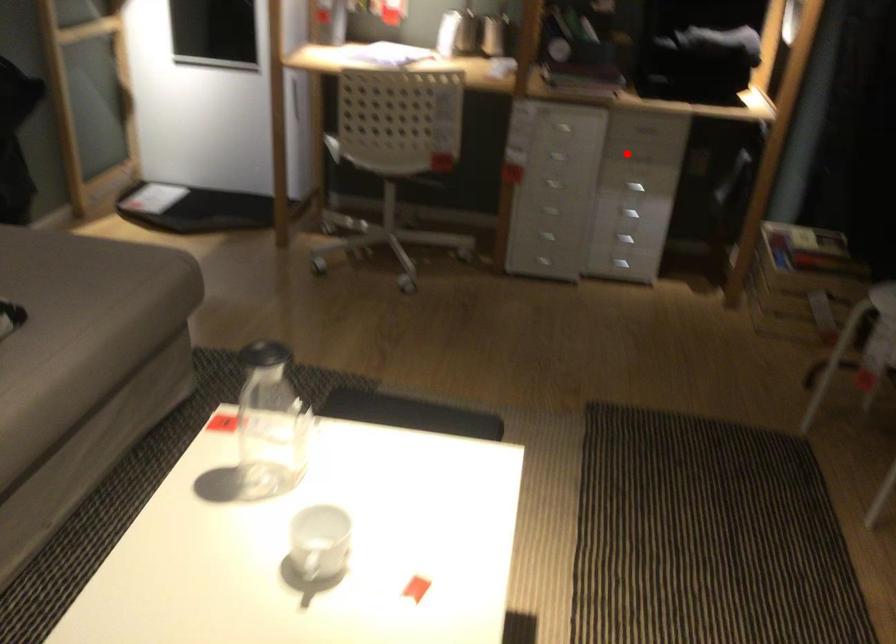
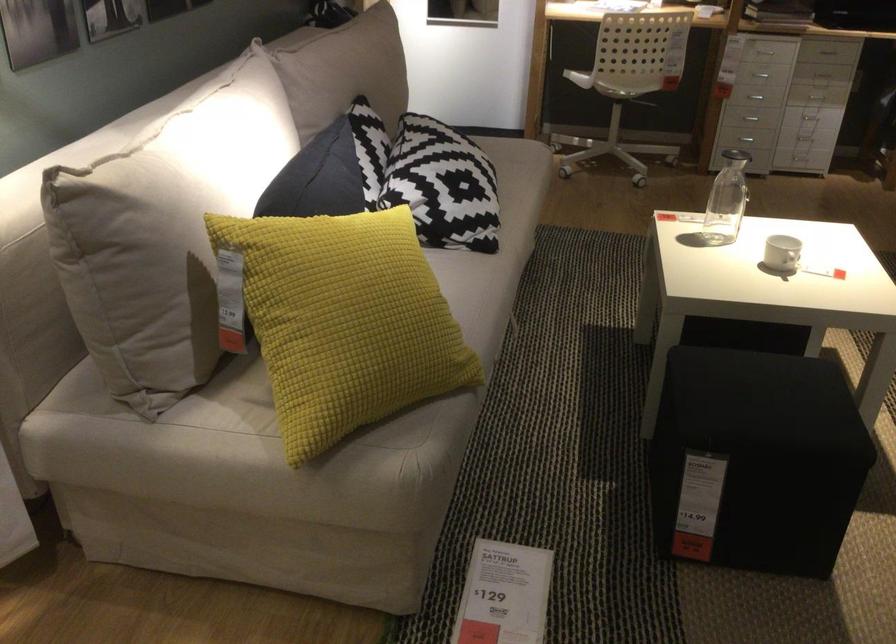
Question: I am providing you with two images of the same scene from different viewpoints. In image1, a red point is highlighted. Considering the same 3D point in image2, which of the following is correct?

Choices:
 (A) It is closer
 (B) It is farther

Answer: (B)